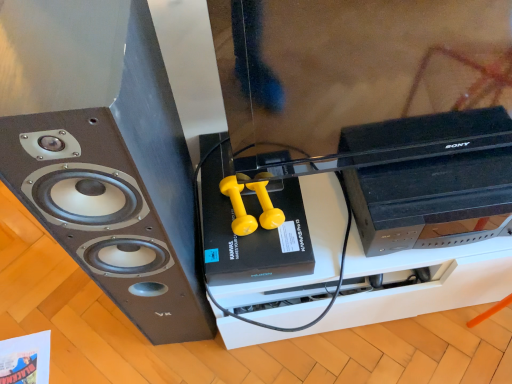
Question: Is black matte speaker at left taller than black plastic computer at right?

Choices:
 (A) no
 (B) yes

Answer: (B)

Question: Considering the relative sizes of black matte speaker at left and black plastic computer at right in the image provided, is black matte speaker at left wider than black plastic computer at right?

Choices:
 (A) yes
 (B) no

Answer: (A)

Question: Would you say black matte speaker at left contains black plastic computer at right?

Choices:
 (A) yes
 (B) no

Answer: (B)

Question: From the image's perspective, is black matte speaker at left located above black plastic computer at right?

Choices:
 (A) no
 (B) yes

Answer: (A)

Question: Can you see black matte speaker at left touching black plastic computer at right?

Choices:
 (A) no
 (B) yes

Answer: (A)

Question: Is black matte speaker at left positioned before black plastic computer at right?

Choices:
 (A) yes
 (B) no

Answer: (A)

Question: Does black plastic computer at right appear on the left side of black matte speaker at left?

Choices:
 (A) yes
 (B) no

Answer: (B)

Question: Is black plastic computer at right shorter than black matte speaker at left?

Choices:
 (A) no
 (B) yes

Answer: (B)

Question: Is black plastic computer at right taller than black matte speaker at left?

Choices:
 (A) no
 (B) yes

Answer: (A)

Question: Considering the relative positions of black plastic computer at right and black matte speaker at left in the image provided, is black plastic computer at right in front of black matte speaker at left?

Choices:
 (A) no
 (B) yes

Answer: (A)

Question: Considering the relative sizes of black plastic computer at right and black matte speaker at left in the image provided, is black plastic computer at right bigger than black matte speaker at left?

Choices:
 (A) yes
 (B) no

Answer: (B)

Question: Does black plastic computer at right have a lesser width compared to black matte speaker at left?

Choices:
 (A) yes
 (B) no

Answer: (A)

Question: Based on their positions, is black matte speaker at left located to the left or right of black plastic computer at right?

Choices:
 (A) right
 (B) left

Answer: (B)